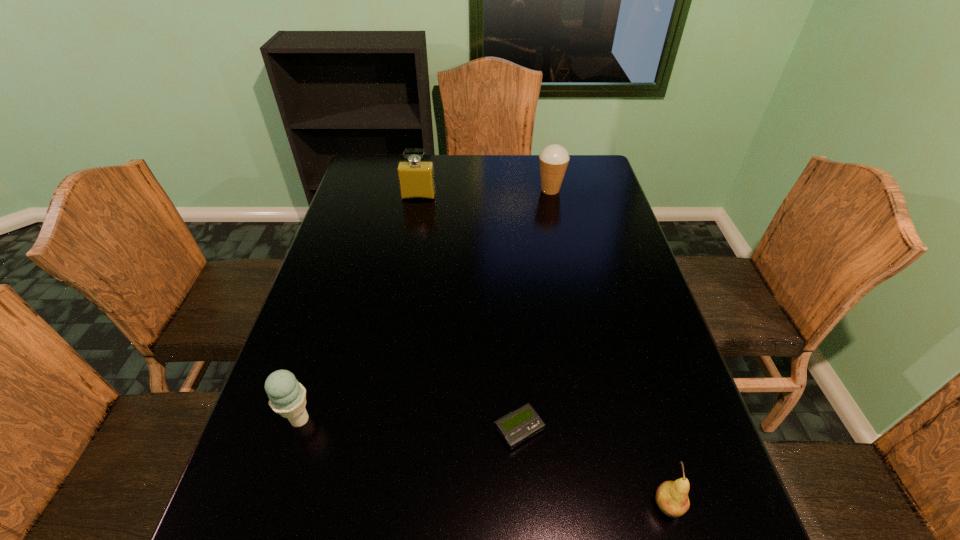
I want to click on perfume, so click(416, 178).

In order to click on the right ice cream in this screenshot , I will do `click(554, 159)`.

This screenshot has height=540, width=960. Identify the location of the second object from right to left. (554, 159).

Identify the location of the nearer ice cream. (287, 397).

What are the coordinates of `the leftmost object` in the screenshot? It's located at (287, 397).

Find the location of a particular element. the rightmost object is located at coordinates (671, 497).

Locate an element on the screen. The height and width of the screenshot is (540, 960). the fourth tallest object is located at coordinates (671, 497).

What are the coordinates of `beeper` in the screenshot? It's located at (515, 427).

The image size is (960, 540). What are the coordinates of `the shortest object` in the screenshot? It's located at (515, 427).

The image size is (960, 540). Find the location of `vacant space located on the front-facing side of the perfume`. vacant space located on the front-facing side of the perfume is located at coordinates (403, 281).